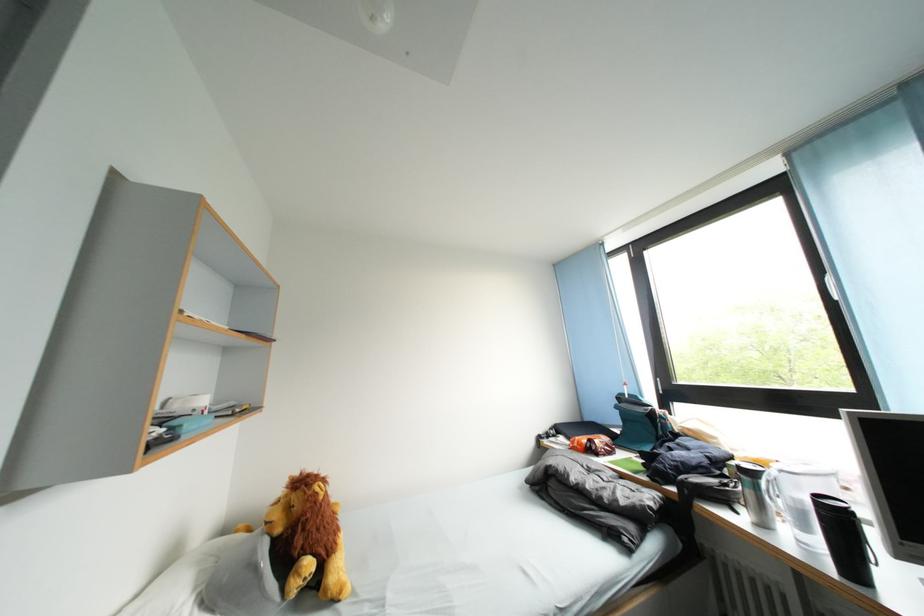
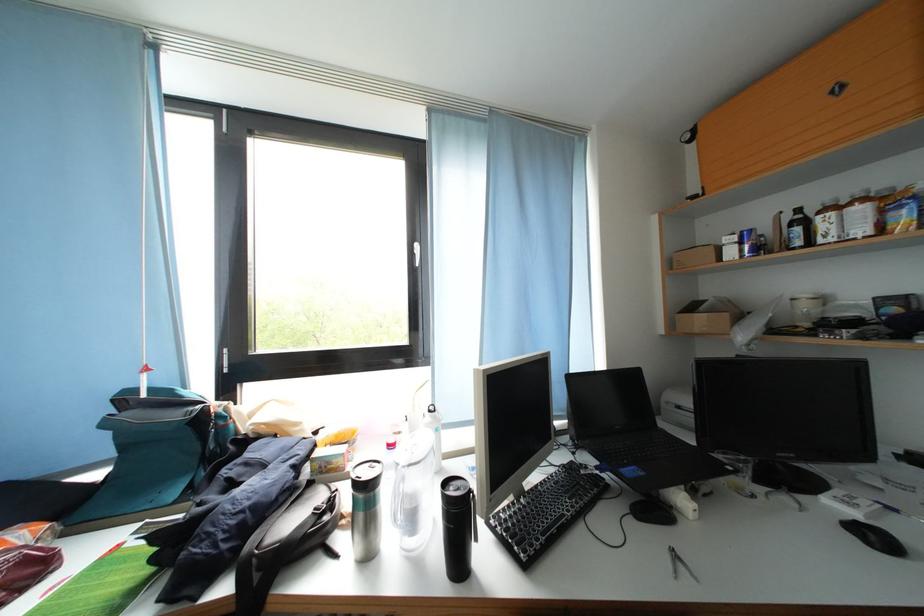
Find the pixel in the second image that matches the point at 844,522 in the first image.

(470, 514)